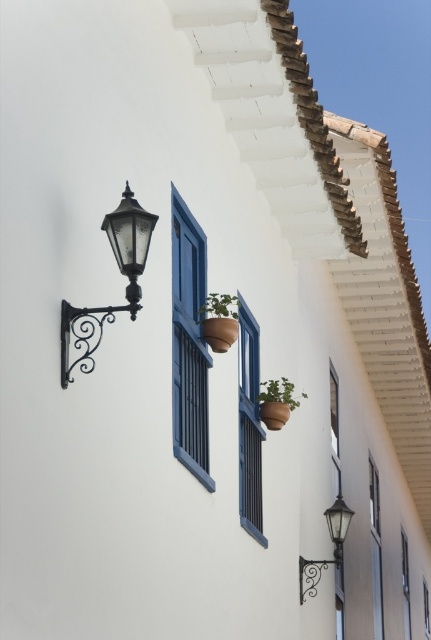
You are standing at the base of the building and want to reach both the blue painted wood shutter at center and the matte black lantern at upper left. Which object is closer to you?

The blue painted wood shutter at center is closer to you since it is only 9.83 meters away from the matte black lantern at upper left, and you are standing at the base of the building.